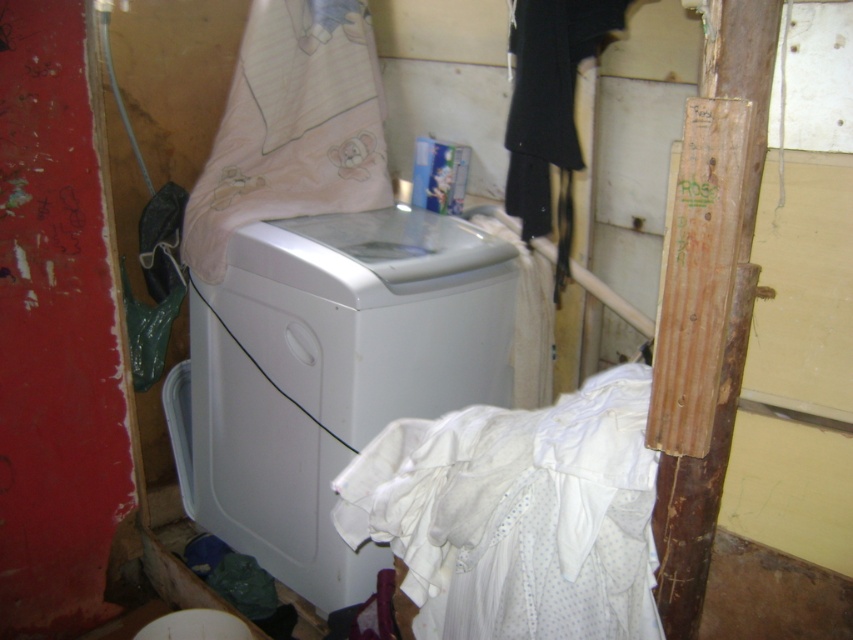
Question: Which object is farther from the camera taking this photo?

Choices:
 (A) pink fabric laundry at center
 (B) white cotton laundry at center

Answer: (A)

Question: Which point is farther to the camera?

Choices:
 (A) white plastic washing machine at center
 (B) white cotton laundry at center
 (C) pink fabric laundry at center

Answer: (C)

Question: Can you confirm if white cotton laundry at center is thinner than pink fabric laundry at center?

Choices:
 (A) no
 (B) yes

Answer: (A)

Question: Where is white cotton laundry at center located in relation to pink fabric laundry at center in the image?

Choices:
 (A) above
 (B) below

Answer: (B)

Question: Which of the following is the farthest from the observer?

Choices:
 (A) (471, 324)
 (B) (381, 470)

Answer: (A)

Question: Does white cotton laundry at center appear on the left side of pink fabric laundry at center?

Choices:
 (A) yes
 (B) no

Answer: (B)